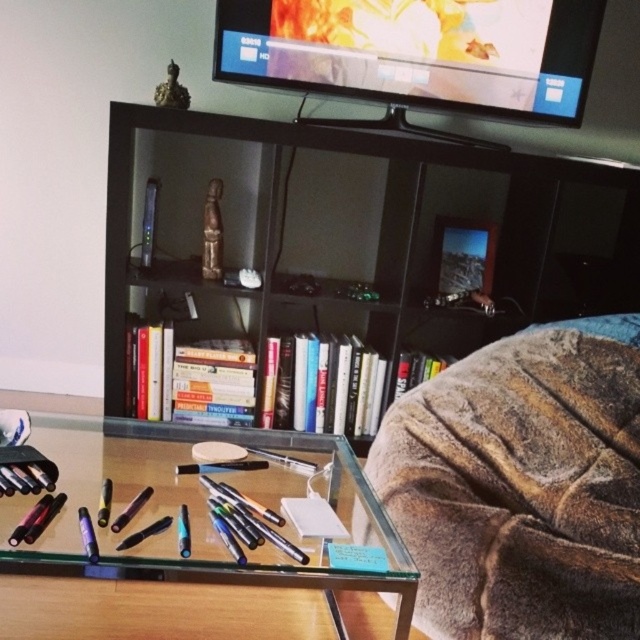
You are standing at the entrance of the room and want to sit down on the fuzzy brown couch at lower right. Which direction should you walk to reach it?

You should walk towards the lower right direction to reach the fuzzy brown couch at lower right as it is located at point (522, 484).

You are standing in the living room and want to determine which of the two points, point (x=483, y=186) or point (x=305, y=604), is closer to you. Based on the scene description, which point is nearer?

Point (x=305, y=604) is closer to you because the description states that point (x=483, y=186) is further to the camera than point (x=305, y=604).